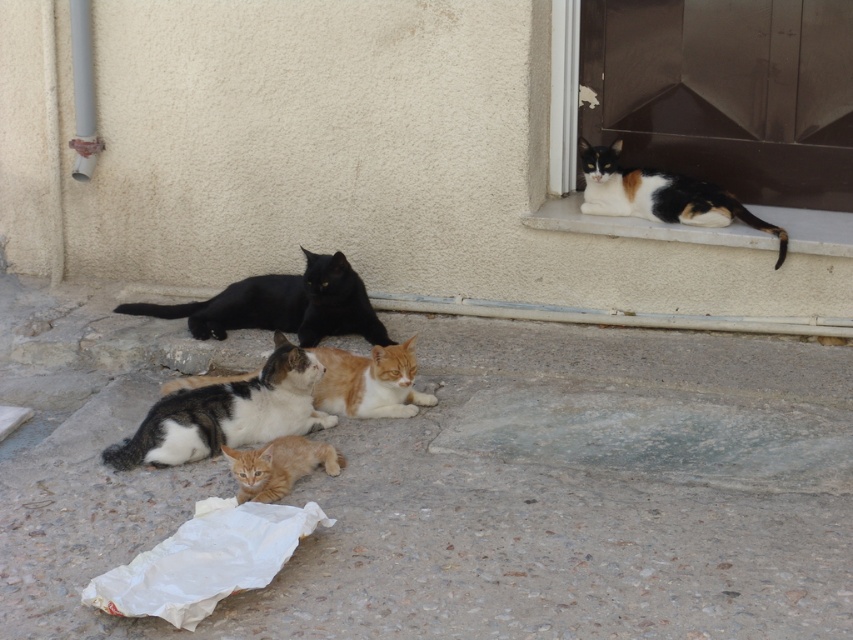
You are standing in front of the scene and want to know which of the two points, point (318, 420) or point (289, 300), is nearer to you. Can you determine this based on their positions?

Point (318, 420) is closer to the camera than point (289, 300), so it is nearer to you.

You are a photographer standing at the entrance of the building. You want to take a photo that includes both the orange and white fur at center and the orange fur cat at lower center. What is the minimum distance you need to move backward to ensure both subjects are in focus?

The minimum distance you need to move backward is 26.41 inches to ensure both the orange and white fur at center and the orange fur cat at lower center are in focus.

You are a photographer trying to capture a photo of both the calico fur cat at center and the black matte cat at center. Since you want them both in the frame, can you tell me which cat is positioned to the right of the other?

The calico fur cat at center is to the right of the black matte cat at center, so the calico fur cat at center is positioned to the right side of the black matte cat at center.